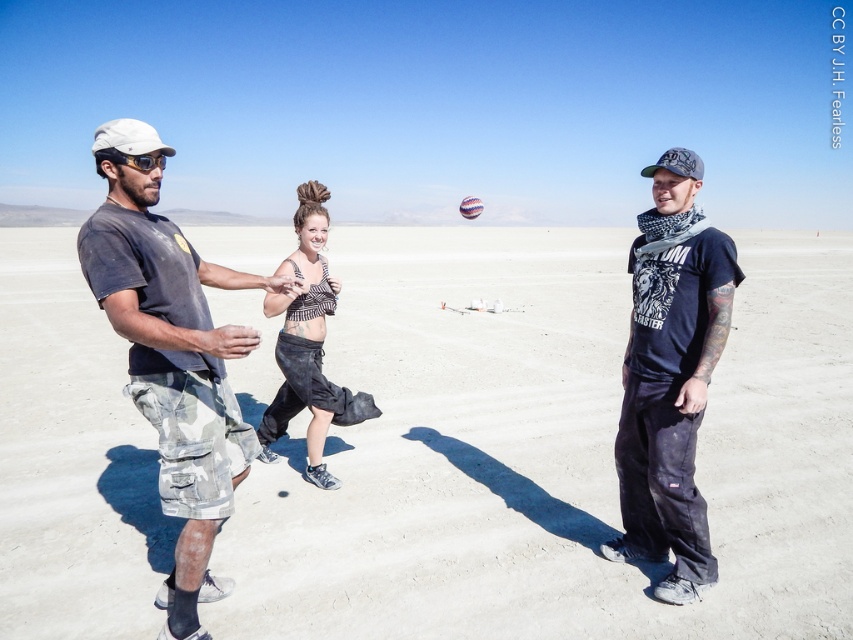
Between dark blue cotton t-shirt at right and black denim skirt at center, which one has less height?

black denim skirt at center

Between point (665, 541) and point (322, 480), which one is positioned in front?

Point (665, 541) is in front.

The height and width of the screenshot is (640, 853). Find the location of `dark blue cotton t-shirt at right`. dark blue cotton t-shirt at right is located at coordinates (670, 376).

This screenshot has height=640, width=853. What are the coordinates of `dark blue cotton t-shirt at right` in the screenshot? It's located at (670, 376).

Is point (175, 634) less distant than point (663, 465)?

That is True.

Does camouflage cargo shorts at left have a greater height compared to dark blue cotton t-shirt at right?

Indeed, camouflage cargo shorts at left has a greater height compared to dark blue cotton t-shirt at right.

Is point (160, 493) farther from viewer compared to point (695, 180)?

No, (160, 493) is in front of (695, 180).

Image resolution: width=853 pixels, height=640 pixels. What are the coordinates of `camouflage cargo shorts at left` in the screenshot? It's located at (171, 353).

Can you confirm if white sand at center is positioned to the right of dark blue cotton t-shirt at right?

In fact, white sand at center is to the left of dark blue cotton t-shirt at right.

Is point (476, 342) behind point (670, 586)?

Yes, point (476, 342) is farther from viewer.

The image size is (853, 640). What are the coordinates of `white sand at center` in the screenshot? It's located at (547, 449).

This screenshot has height=640, width=853. Identify the location of white sand at center. (547, 449).